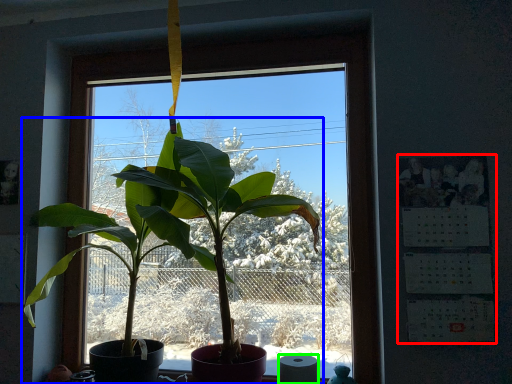
Question: Which object is positioned farthest from bulletin board (highlighted by a red box)? Select from houseplant (highlighted by a blue box) and toilet paper (highlighted by a green box).

Choices:
 (A) houseplant
 (B) toilet paper

Answer: (A)